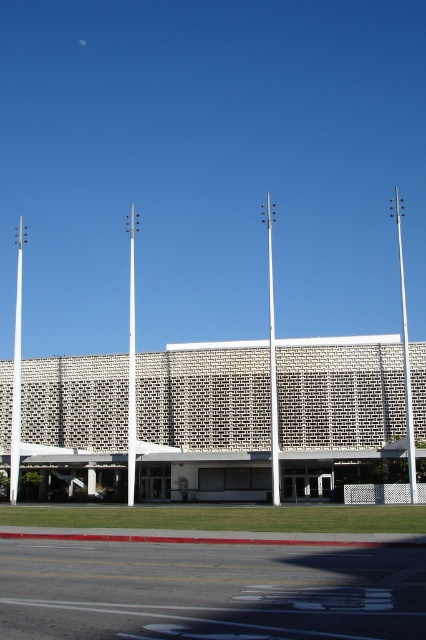
You are standing at point (17, 371) in the scene. What object is located at that exact point?

The white smooth pole at left is located at point (17, 371).

You are an architect designing a new plaza and want to place a bench between the two poles in the image. The bench requires a minimum of 0.5 meters of space between itself and any pole. Given the distance between the white metallic pole at center and the white smooth pole at center, can the bench be placed between them?

The bench cannot be placed between the white metallic pole at center and the white smooth pole at center because the distance between them is not specified in the provided information.

In the scene shown: You are standing in front of the building and want to walk from the white smooth pole at left to the white metallic pole at center. Which direction should you face to move towards the pole that is closer to you?

You should face towards the white metallic pole at center because the white smooth pole at left is further to the viewer than the white metallic pole at center, so the closer pole is the white metallic pole at center.